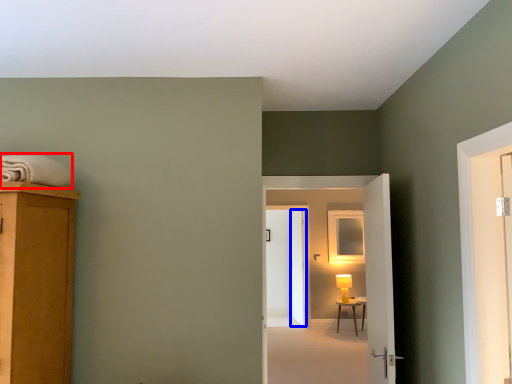
Question: Which object is further to the camera taking this photo, bath towel (highlighted by a red box) or screen door (highlighted by a blue box)?

Choices:
 (A) bath towel
 (B) screen door

Answer: (B)